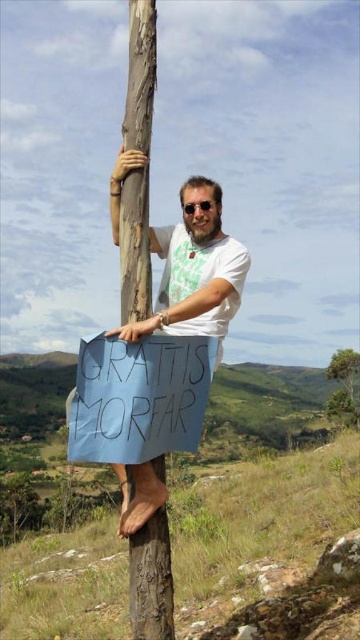
You are a hiker who wants to take a photo of the green leafy tree at upper right without the black plastic goggles at upper center blocking the view. Is there a way to position yourself so that the tree is visible without the goggles?

The green leafy tree at upper right is positioned under the black plastic goggles at upper center. To take a photo of the green leafy tree at upper right without the goggles blocking the view, you can move to a position where the goggles are out of the frame or adjust your angle so the tree is framed around the goggles.